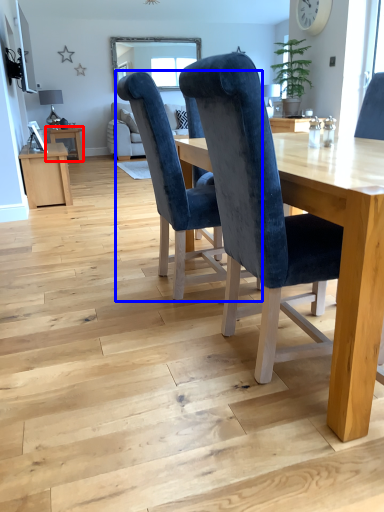
Question: Which object is further to the camera taking this photo, table (highlighted by a red box) or chair (highlighted by a blue box)?

Choices:
 (A) table
 (B) chair

Answer: (A)